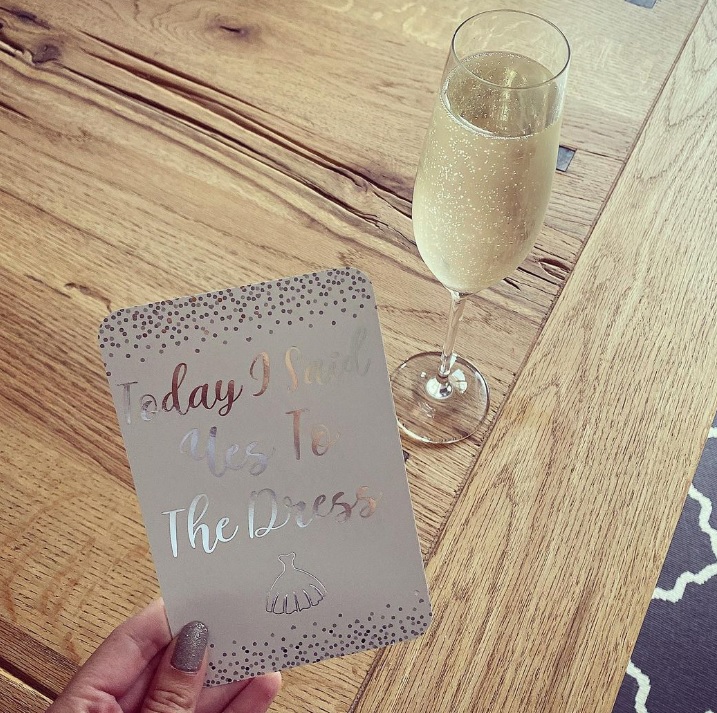
The height and width of the screenshot is (713, 717). In order to click on wine glass rim in this screenshot , I will do `click(521, 85)`.